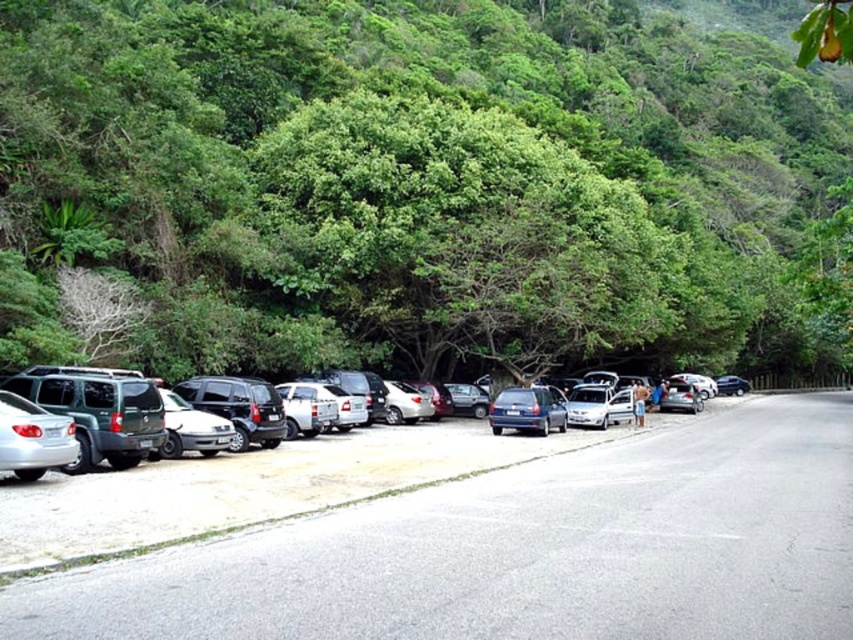
You are a driver trying to park your car in the parking area. You notice the metallic silver car at center and the green leafy tree at center. Which object is higher in elevation?

The green leafy tree at center is above the metallic silver car at center, so the green leafy tree at center is higher in elevation.

You are a pedestrian trying to cross the road to reach the parking area. There is a green leafy tree at center and a metallic silver car at center blocking your view. Which object is closer to you, making it harder to see the other side?

The green leafy tree at center is in front of the metallic silver car at center, so the tree is closer to you and obstructs your view more than the car.

You are a delivery driver who needs to park your truck, which is 6 meters long, in this parking area. The parking spot is between the metallic silver car at center and the blue metallic hatchback at center. Can your truck fit in the space between them?

The metallic silver car at center is larger in size than the blue metallic hatchback at center, but the exact distance between them isn not provided. Without knowing the space between the two vehicles, it is impossible to determine if the truck can fit.